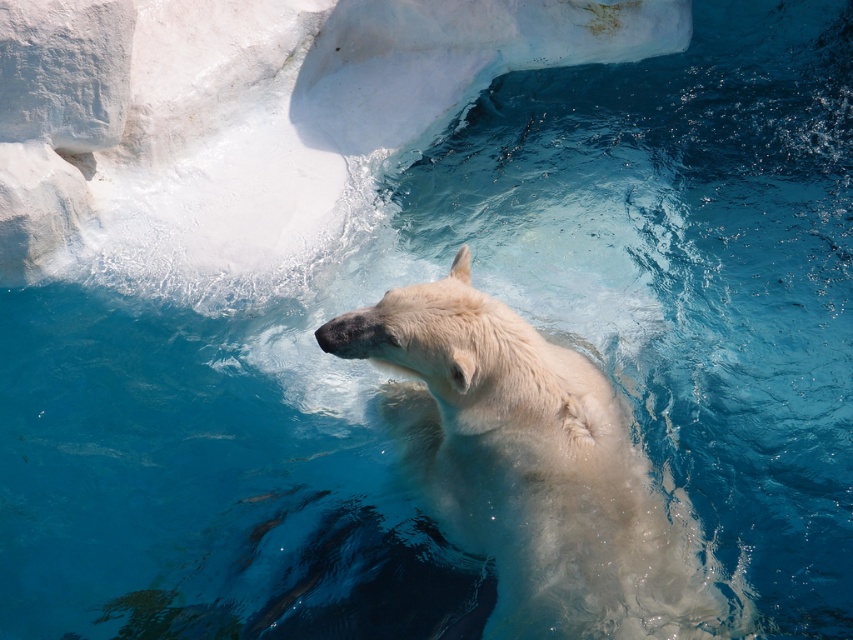
Question: Which object is closer to the camera taking this photo?

Choices:
 (A) white fur bear at center
 (B) white smooth rock at upper left

Answer: (A)

Question: Is white fur bear at center positioned at the back of white smooth rock at upper left?

Choices:
 (A) no
 (B) yes

Answer: (A)

Question: Can you confirm if white fur bear at center is positioned below white smooth rock at upper left?

Choices:
 (A) yes
 (B) no

Answer: (A)

Question: Which object is farther from the camera taking this photo?

Choices:
 (A) white fur bear at center
 (B) white smooth rock at upper left

Answer: (B)

Question: Can you confirm if white fur bear at center is smaller than white smooth rock at upper left?

Choices:
 (A) yes
 (B) no

Answer: (B)